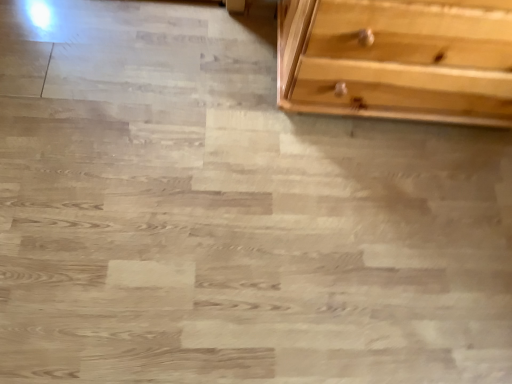
You are a GUI agent. You are given a task and a screenshot of the screen. Output one action in this format:
    pyautogui.click(x=<x>, y=<y>)
    Task: Click on the vacant space situated on the left part of light wood chest of drawers at upper right
    
    Given the screenshot: What is the action you would take?
    pyautogui.click(x=195, y=81)